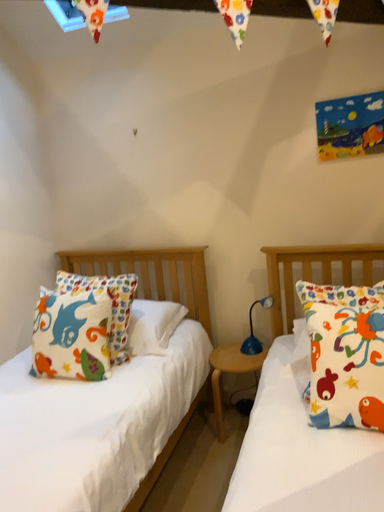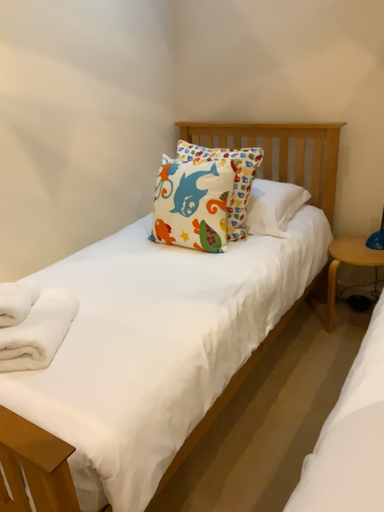
Question: How did the camera likely rotate when shooting the video?

Choices:
 (A) rotated upward
 (B) rotated downward

Answer: (B)